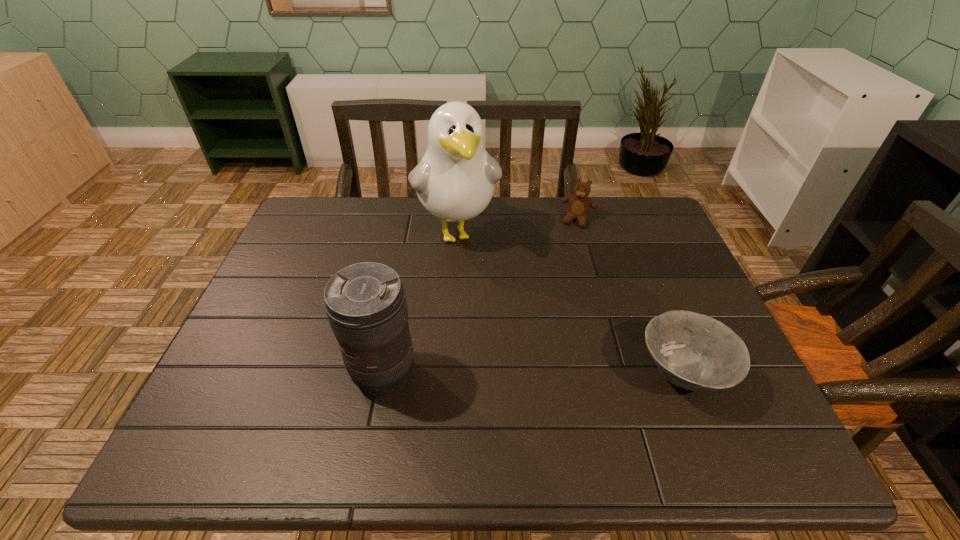
Where is `vacant space located 0.140m on the beak of the gull`? The height and width of the screenshot is (540, 960). vacant space located 0.140m on the beak of the gull is located at coordinates (476, 301).

This screenshot has height=540, width=960. In order to click on teddy bear that is at the far edge in this screenshot , I will do `click(579, 205)`.

You are a GUI agent. You are given a task and a screenshot of the screen. Output one action in this format:
    pyautogui.click(x=<x>, y=<y>)
    Task: Click on the gull that is at the far edge
    Image resolution: width=960 pixels, height=540 pixels.
    Given the screenshot: What is the action you would take?
    pyautogui.click(x=455, y=180)

Identify the location of telephoto lens that is at the near edge. This screenshot has height=540, width=960. (365, 303).

The image size is (960, 540). I want to click on bowl located in the near edge section of the desktop, so click(x=693, y=351).

Where is `object that is at the right edge`? The width and height of the screenshot is (960, 540). object that is at the right edge is located at coordinates (693, 351).

You are a GUI agent. You are given a task and a screenshot of the screen. Output one action in this format:
    pyautogui.click(x=<x>, y=<y>)
    Task: Click on the object that is at the near right corner
    The width and height of the screenshot is (960, 540).
    Given the screenshot: What is the action you would take?
    pyautogui.click(x=693, y=351)

Image resolution: width=960 pixels, height=540 pixels. Find the location of `free space at the far edge of the desktop`. free space at the far edge of the desktop is located at coordinates (354, 227).

I want to click on blank space at the near edge of the desktop, so click(x=616, y=377).

Where is `free point at the left edge`? This screenshot has width=960, height=540. free point at the left edge is located at coordinates (304, 289).